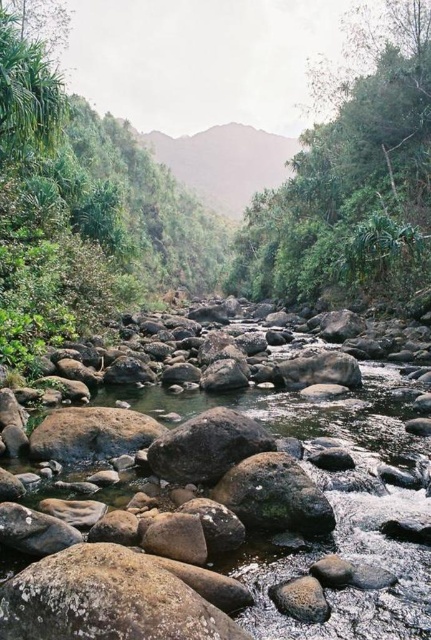
Who is more distant from viewer, (396, 26) or (33, 56)?

The point (396, 26) is behind.

Between point (365, 19) and point (18, 120), which one is positioned in front?

Positioned in front is point (18, 120).

Where is `green leafy tree at upper right`? The height and width of the screenshot is (640, 431). green leafy tree at upper right is located at coordinates (352, 177).